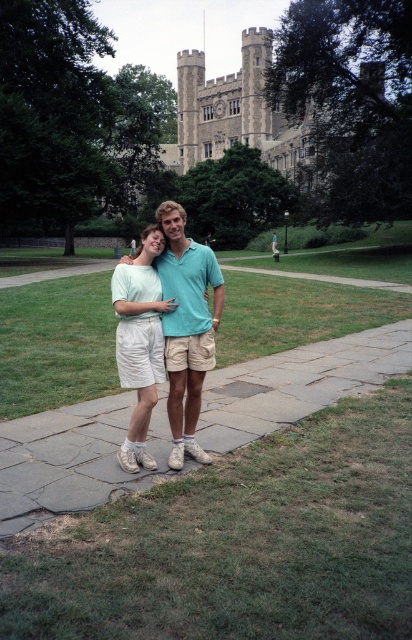
Question: Among these objects, which one is farthest from the camera?

Choices:
 (A) light blue cotton shirt at center
 (B) gray stone pavement at center

Answer: (B)

Question: Is gray stone pavement at center to the right of light blue cotton shirt at center from the viewer's perspective?

Choices:
 (A) no
 (B) yes

Answer: (B)

Question: Which of the following is the closest to the observer?

Choices:
 (A) light blue cotton shirt at center
 (B) gray stone pavement at center

Answer: (A)

Question: Can you confirm if gray stone pavement at center is wider than light blue cotton shirt at center?

Choices:
 (A) no
 (B) yes

Answer: (A)

Question: Is gray stone pavement at center above light blue cotton shirt at center?

Choices:
 (A) yes
 (B) no

Answer: (B)